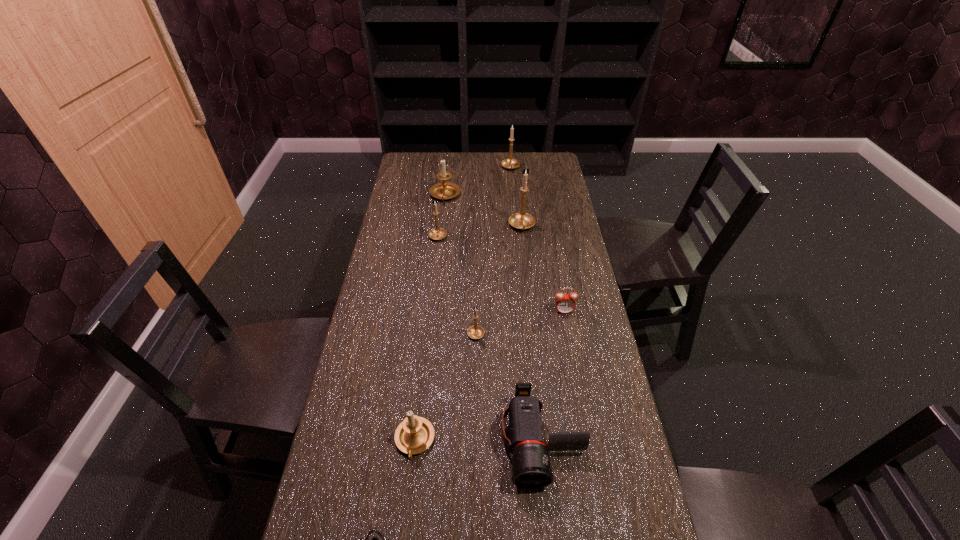
Identify the location of the tallest object. The width and height of the screenshot is (960, 540). (522, 220).

This screenshot has width=960, height=540. What are the coordinates of `the tallest candle holder` in the screenshot? It's located at (522, 220).

Image resolution: width=960 pixels, height=540 pixels. I want to click on the fifth shortest candle holder, so click(510, 163).

Locate an element on the screen. the farthest gold candle holder is located at coordinates (510, 163).

This screenshot has width=960, height=540. I want to click on the second smallest gold candle holder, so [436, 234].

Find the location of a particular element. Image resolution: width=960 pixels, height=540 pixels. the fifth nearest candle holder is located at coordinates pyautogui.click(x=445, y=190).

This screenshot has height=540, width=960. Find the location of `the farther beige candle holder`. the farther beige candle holder is located at coordinates (445, 190).

At what (x,y) coordinates should I click in order to perform the action: click on the fourth candle holder from left to right. Please return your answer as a coordinate pair (x, y). The image size is (960, 540). Looking at the image, I should click on (475, 332).

I want to click on the fourth nearest object, so click(475, 332).

Where is `the nearest candle holder`? The width and height of the screenshot is (960, 540). the nearest candle holder is located at coordinates 415,434.